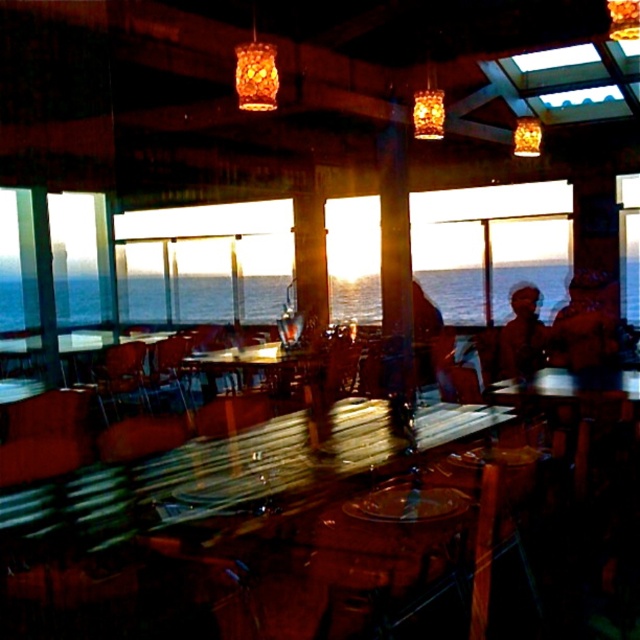
You are a customer sitting at a table in this restaurant. You notice the blue water at center and the patterned fabric headscarf at center in your line of sight. Which object is wider from your perspective?

The blue water at center is wider than the patterned fabric headscarf at center from your perspective.

You are a customer entering the restaurant and want to sit at the wooden chair at center. When you look towards the blue water at center from the chair, what do you see?

When looking towards the blue water at center from the wooden chair at center, you see the blue water at center positioned in front of the wooden chair at center, so it would be directly ahead in your view.

You are a customer sitting in the wooden chair at center in a restaurant with a view of the ocean. You want to look at the blue water at center. In which direction should you turn your head?

The blue water at center is to the right of the wooden chair at center, so you should turn your head to the right to look at the blue water at center.